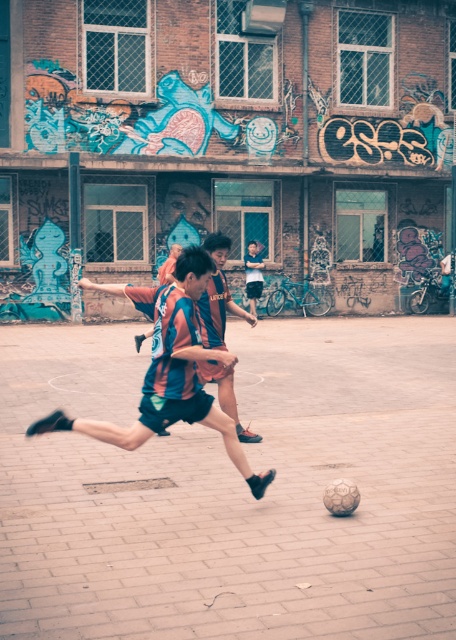
You are a photographer trying to capture the soccer player in motion. The soccer ball is at the point with coordinates (169, 369). Where should you focus your camera to ensure you capture the striped jersey at center?

The point (169, 369) corresponds to the striped jersey at center, so you should focus your camera on that point to capture the striped jersey at center.

You are a photographer trying to capture both the striped jersey at center and the multicolored jersey at center in a single shot. Based on their sizes, which jersey should you focus on to ensure both are in frame without zooming in or out?

The striped jersey at center might be wider than multicolored jersey at center, so focusing on the striped jersey at center would help keep both in frame since it is wider.